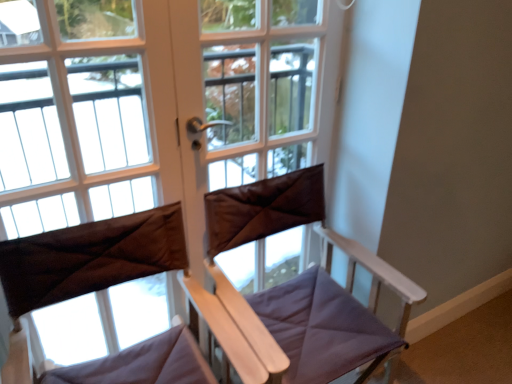
Question: Does point (88, 286) appear closer or farther from the camera than point (224, 48)?

Choices:
 (A) closer
 (B) farther

Answer: (A)

Question: From the image's perspective, is brown fabric curtain at center located above or below brown fabric at center?

Choices:
 (A) above
 (B) below

Answer: (B)

Question: Which of these objects is positioned closest to the brown leather screen door at center?

Choices:
 (A) brown fabric curtain at center
 (B) matte brown curtain at left
 (C) purple fabric chair at center
 (D) brown fabric at center

Answer: (D)

Question: Based on their relative distances, which object is nearer to the brown leather screen door at center?

Choices:
 (A) matte brown curtain at left
 (B) purple fabric chair at center
 (C) brown fabric at center
 (D) brown fabric curtain at center

Answer: (C)